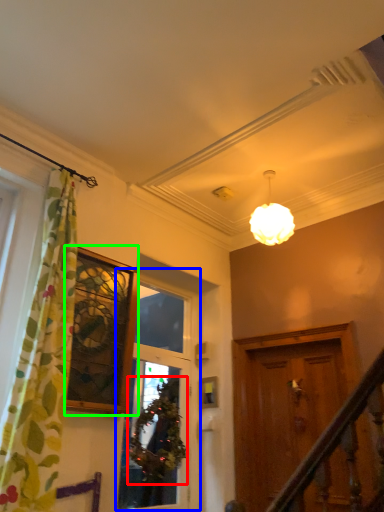
Question: Which is nearer to the plant (highlighted by a red box)? window (highlighted by a blue box) or window (highlighted by a green box).

Choices:
 (A) window
 (B) window

Answer: (A)